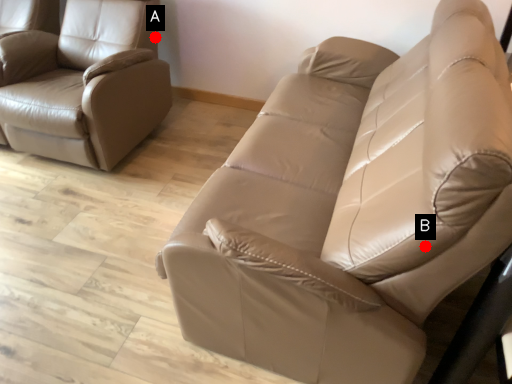
Question: Two points are circled on the image, labeled by A and B beside each circle. Among these points, which one is farthest from the camera?

Choices:
 (A) A is further
 (B) B is further

Answer: (A)